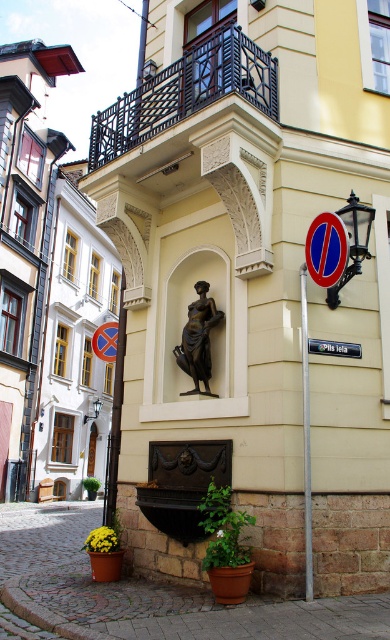
You are a city planner assessing the street layout. The brushed metal pole at center and the blue plastic sign at center are both in the same area. Which object has a smaller diameter?

The brushed metal pole at center is thinner than the blue plastic sign at center, so the brushed metal pole at center has a smaller diameter.

You are a delivery person needing to park your bike between the bronze statue at center and the brushed metal pole at center. The bike requires 6 feet of space. Can you fit it there?

The distance between the bronze statue at center and the brushed metal pole at center is 5.65 feet, which is less than the required 6 feet. Therefore, the bike cannot be parked there.